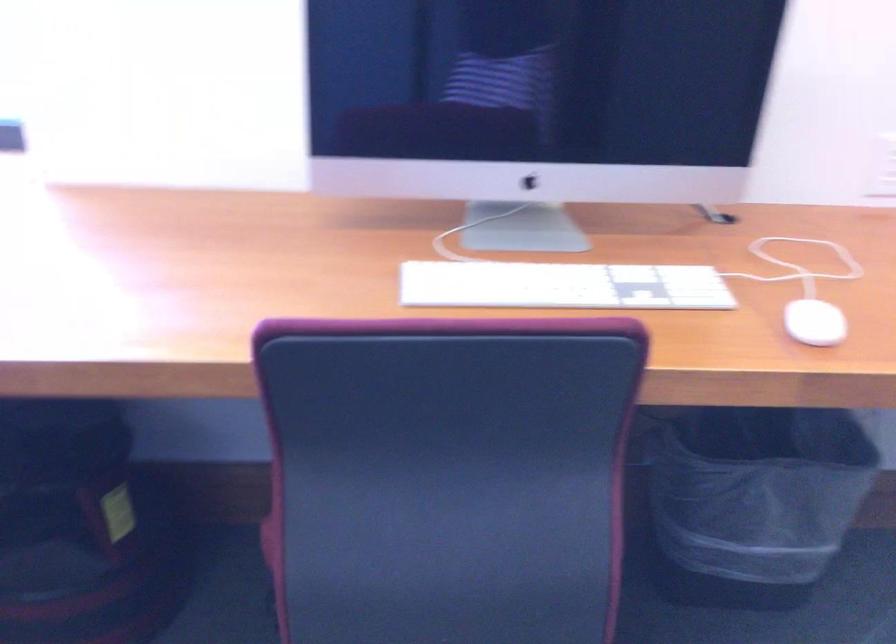
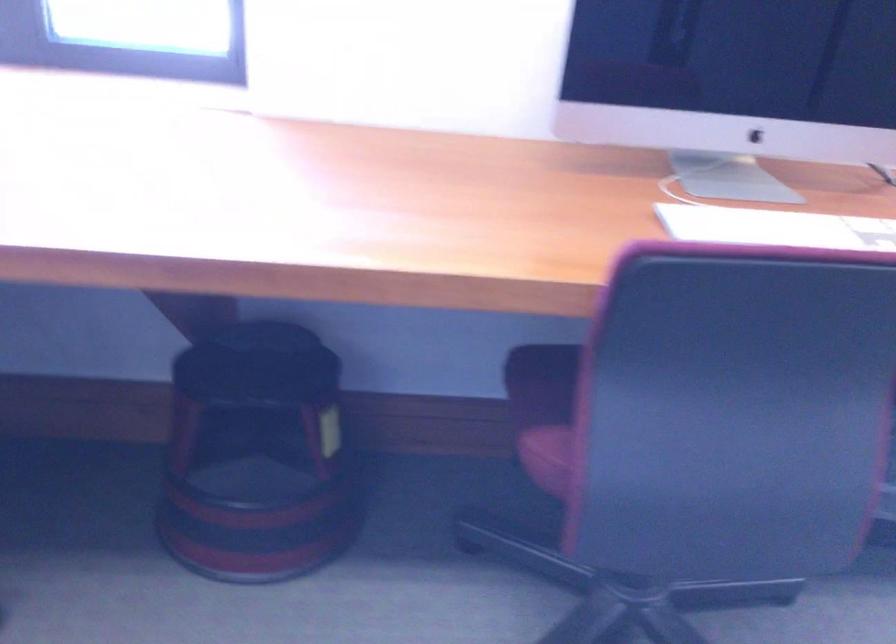
Question: The images are taken continuously from a first-person perspective. In which direction is your viewpoint rotating?

Choices:
 (A) Left
 (B) Right
 (C) Up
 (D) Down

Answer: (B)